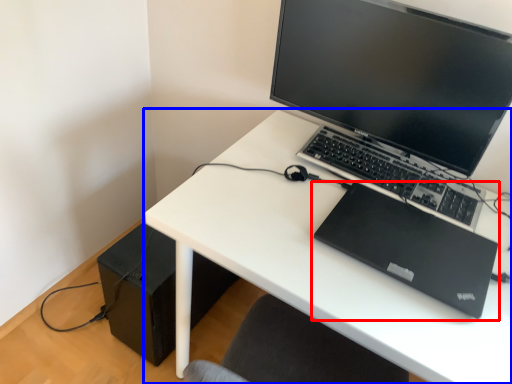
Question: Which point is closer to the camera, laptop (highlighted by a red box) or desk (highlighted by a blue box)?

Choices:
 (A) laptop
 (B) desk

Answer: (B)